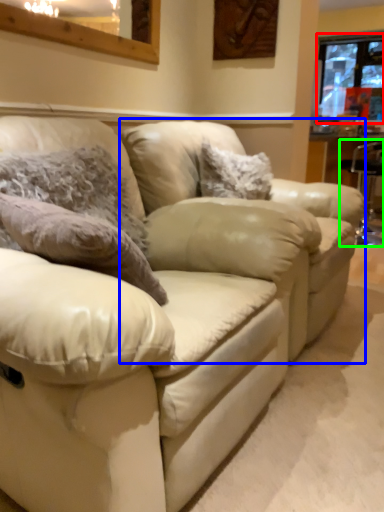
Question: Which object is the closest to the window (highlighted by a red box)? Choose among these: swivel chair (highlighted by a blue box) or bar stool (highlighted by a green box).

Choices:
 (A) swivel chair
 (B) bar stool

Answer: (B)